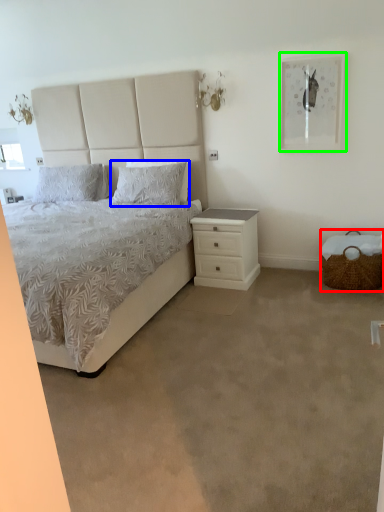
Question: Which object is positioned farthest from basket (highlighted by a red box)? Select from pillow (highlighted by a blue box) and picture frame (highlighted by a green box).

Choices:
 (A) pillow
 (B) picture frame

Answer: (A)